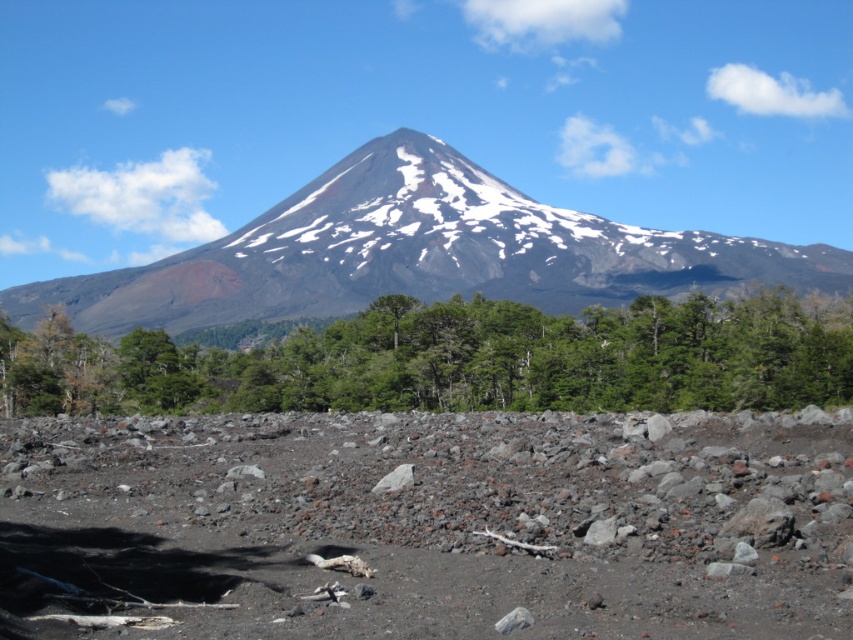
From the picture: You are a hiker planning a route from the barren ground with scattered rocks to the dense vegetation. Which direction should you head towards to reach the green leafy trees at center first before the snowy volcanic peak at center?

You should head towards the left direction to reach the green leafy trees at center first before the snowy volcanic peak at center, as the green leafy trees at center is located to the left of the snowy volcanic peak at center.

You are a hiker standing at the point marked as point (459, 358) in the image. Based on the scene description, what do you see directly in front of you?

You see green leafy trees at center directly in front of you.